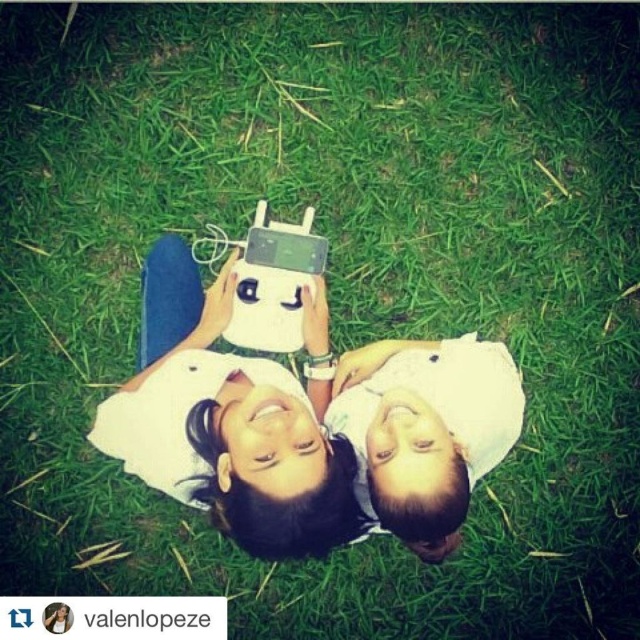
Question: Which object appears farthest from the camera in this image?

Choices:
 (A) white matte phone at center
 (B) white matte shirt at center

Answer: (B)

Question: Observing the image, what is the correct spatial positioning of white matte phone at center in reference to white matte shirt at center?

Choices:
 (A) right
 (B) left

Answer: (B)

Question: Which point is closer to the camera?

Choices:
 (A) white matte phone at center
 (B) white matte shirt at center

Answer: (A)

Question: From the image, what is the correct spatial relationship of white matte phone at center in relation to white matte shirt at center?

Choices:
 (A) below
 (B) above

Answer: (B)

Question: Can you confirm if white matte phone at center is wider than white matte shirt at center?

Choices:
 (A) no
 (B) yes

Answer: (B)